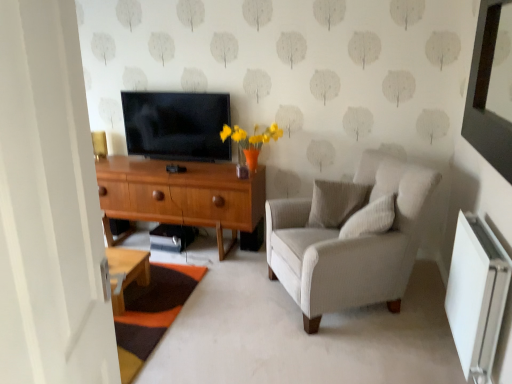
Identify the location of free space in front of light gray fabric armchair at right. (352, 352).